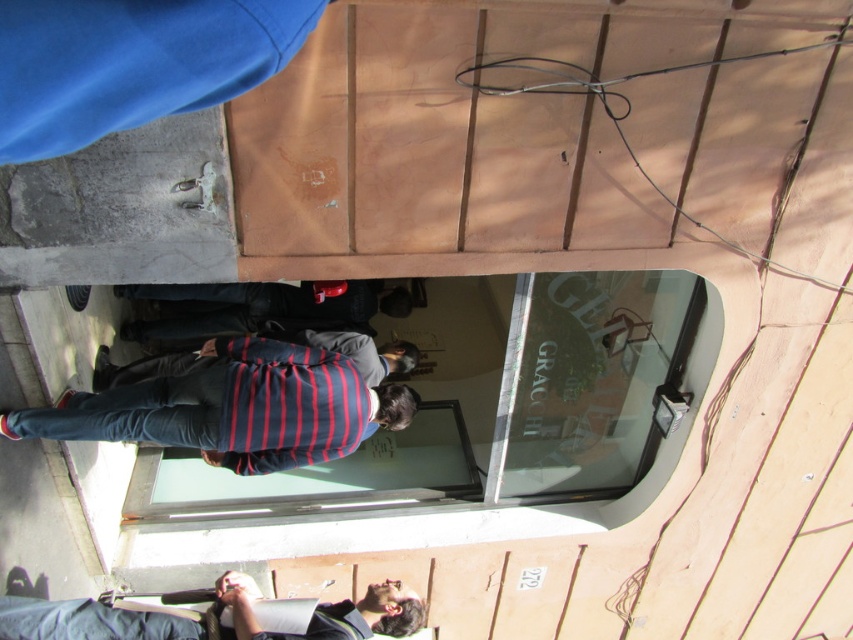
Question: Which point appears closest to the camera in this image?

Choices:
 (A) (235, 392)
 (B) (392, 360)

Answer: (A)

Question: Does blue striped shirt at center appear on the left side of striped fabric shirt at center?

Choices:
 (A) no
 (B) yes

Answer: (B)

Question: In this image, where is striped cotton shirt at center located relative to blue striped shirt at center?

Choices:
 (A) above
 (B) below

Answer: (A)

Question: Which object is closer to the camera taking this photo?

Choices:
 (A) striped fabric shirt at center
 (B) blue striped shirt at center
 (C) striped cotton shirt at center

Answer: (B)

Question: Does blue striped shirt at center appear under striped fabric shirt at center?

Choices:
 (A) no
 (B) yes

Answer: (B)

Question: Which point is farther to the camera?

Choices:
 (A) striped fabric shirt at center
 (B) striped cotton shirt at center
 (C) blue striped shirt at center

Answer: (A)